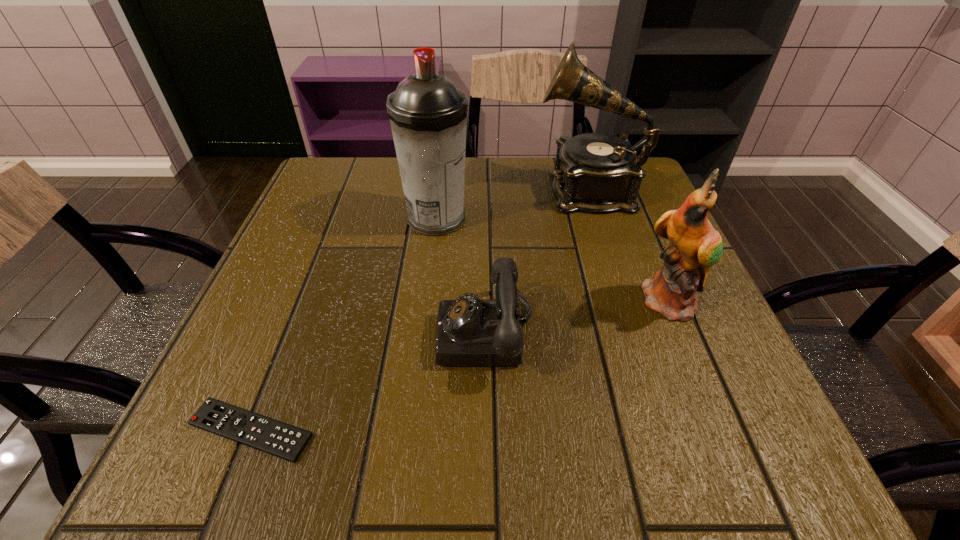
Identify which object is the fourth nearest to the parrot. Please provide its 2D coordinates. Your answer should be formatted as a tuple, i.e. [(x, y)], where the tuple contains the x and y coordinates of a point satisfying the conditions above.

[(285, 441)]

I want to click on vacant position in the image that satisfies the following two spatial constraints: 1. on the dial of the telephone; 2. on the front side of the remote control, so click(x=487, y=430).

This screenshot has width=960, height=540. Identify the location of vacant region that satisfies the following two spatial constraints: 1. on the horn of the phonograph record; 2. on the front side of the aerosol can. (597, 219).